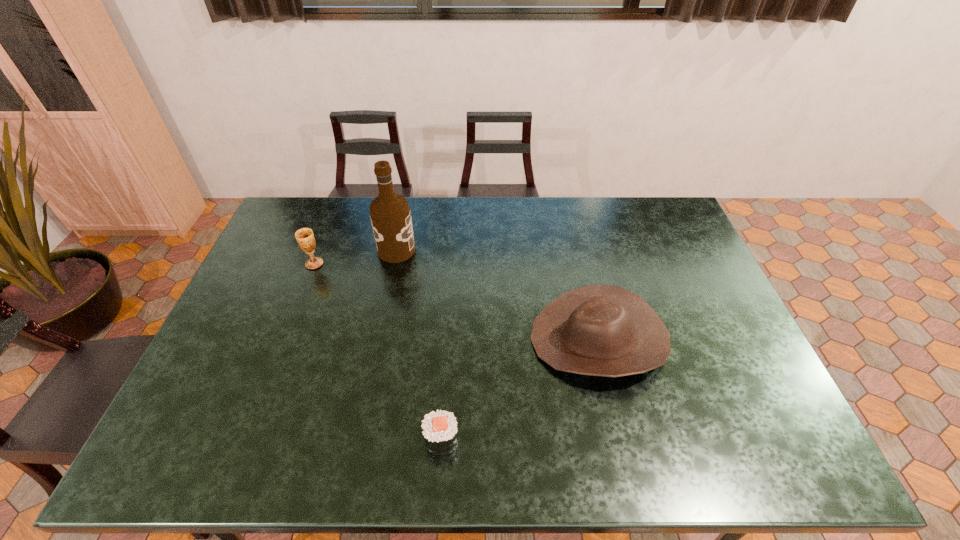
Find the location of a particular element. This screenshot has width=960, height=540. alcohol is located at coordinates click(x=390, y=215).

Where is `the tallest object`? the tallest object is located at coordinates (390, 215).

This screenshot has width=960, height=540. I want to click on the rightmost object, so click(602, 330).

This screenshot has height=540, width=960. In order to click on cowboy hat in this screenshot , I will do `click(602, 330)`.

The width and height of the screenshot is (960, 540). I want to click on the leftmost object, so click(x=304, y=236).

Find the location of a particular element. The image size is (960, 540). the second object from right to left is located at coordinates (439, 427).

Find the location of `the shortest object`. the shortest object is located at coordinates (439, 427).

Where is `vacant space located 0.370m on the label of the second object from left to right`? vacant space located 0.370m on the label of the second object from left to right is located at coordinates (523, 250).

Image resolution: width=960 pixels, height=540 pixels. I want to click on free space located on the right of the second nearest object, so click(684, 340).

I want to click on vacant area situated on the back of the leftmost object, so click(332, 220).